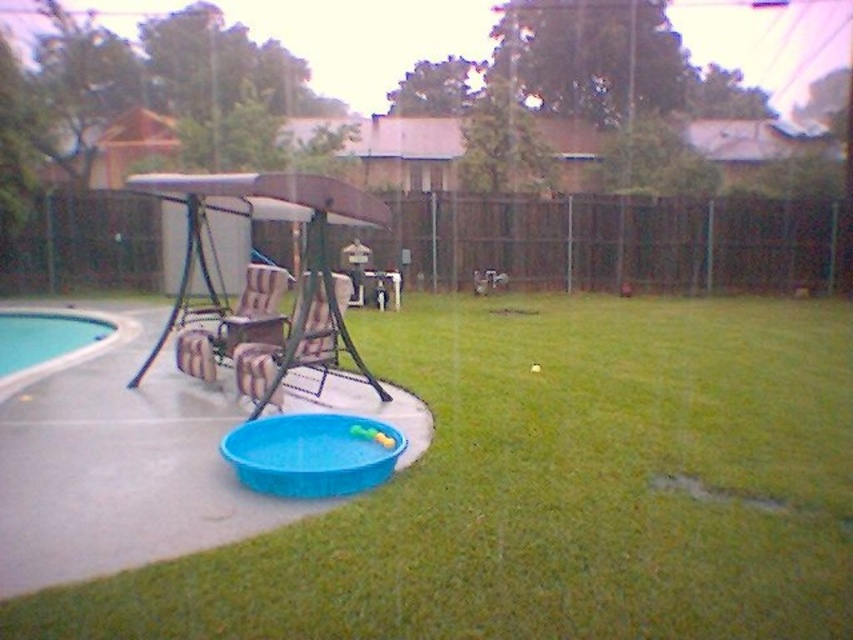
Question: Considering the relative positions of green grass at center and blue plastic pool at lower center in the image provided, where is green grass at center located with respect to blue plastic pool at lower center?

Choices:
 (A) below
 (B) above

Answer: (B)

Question: Observing the image, what is the correct spatial positioning of green grass at center in reference to white smooth pool at lower left?

Choices:
 (A) below
 (B) above

Answer: (A)

Question: Among these points, which one is nearest to the camera?

Choices:
 (A) (80, 324)
 (B) (300, 428)
 (C) (224, 323)

Answer: (B)

Question: Is green grass at center to the right of white smooth pool at lower left from the viewer's perspective?

Choices:
 (A) no
 (B) yes

Answer: (B)

Question: Which point is closer to the camera taking this photo?

Choices:
 (A) (383, 586)
 (B) (296, 436)
 (C) (234, 310)
 (D) (41, 349)

Answer: (A)

Question: Which of the following is the closest to the observer?

Choices:
 (A) (254, 432)
 (B) (242, 298)

Answer: (A)